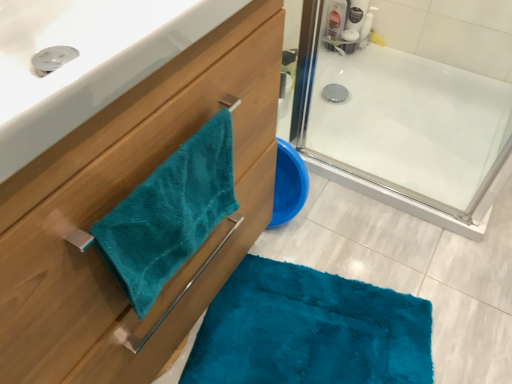
Identify the location of teal plush towel at left. (121, 200).

Find the location of `teal plush towel at left`. teal plush towel at left is located at coordinates (121, 200).

Considering the relative sizes of teal plush towel at left and teal plush towel at left in the image provided, is teal plush towel at left shorter than teal plush towel at left?

In fact, teal plush towel at left may be taller than teal plush towel at left.

From the image's perspective, would you say teal plush towel at left is shown under teal plush towel at left?

No, from the image's perspective, teal plush towel at left is not beneath teal plush towel at left.

Based on the photo, how many degrees apart are the facing directions of teal plush towel at left and teal plush towel at left?

The angle between the facing direction of teal plush towel at left and the facing direction of teal plush towel at left is 0.479 degrees.

Is teal plush towel at left surrounded by teal plush towel at left?

No, teal plush towel at left is located outside of teal plush towel at left.

From a real-world perspective, is translucent plastic bottle at upper right under teal plush towel at left?

Indeed, from a real-world perspective, translucent plastic bottle at upper right is positioned beneath teal plush towel at left.

Locate an element on the screen. Image resolution: width=512 pixels, height=384 pixels. cleaning product that is behind the teal plush towel at left is located at coordinates (366, 28).

Between point (367, 34) and point (204, 174), which one is positioned in front?

Point (204, 174)

Could you tell me if teal plush towel at left is facing teal plush towel at left?

No, teal plush towel at left is not aimed at teal plush towel at left.

Considering the relative positions of teal plush towel at left and teal plush towel at left in the image provided, is teal plush towel at left to the left of teal plush towel at left from the viewer's perspective?

No, teal plush towel at left is not to the left of teal plush towel at left.

Which is behind, point (373, 16) or point (202, 118)?

The point (373, 16) is farther.

Is translucent plastic bottle at upper right beside teal plush towel at left?

translucent plastic bottle at upper right and teal plush towel at left are not in contact.

Is translucent plastic bottle at upper right shorter than teal plush towel at left?

Indeed, translucent plastic bottle at upper right has a lesser height compared to teal plush towel at left.

Which object is closer to the camera, teal plush towel at left or translucent plastic bottle at upper right?

teal plush towel at left is more forward.

Measure the distance from teal plush towel at left to translucent plastic bottle at upper right.

They are 29.45 inches apart.

Is translucent plastic bottle at upper right located within teal plush towel at left?

No.

Can you tell me how much teal plush towel at left and translucent plastic bottle at upper right differ in facing direction?

teal plush towel at left and translucent plastic bottle at upper right are facing 1.73 degrees away from each other.

Is teal plush towel at left far away from translucent plastic bottle at upper right?

No, there isn't a large distance between teal plush towel at left and translucent plastic bottle at upper right.

Considering the sizes of teal plush towel at left and translucent plastic bottle at upper right in the image, is teal plush towel at left taller or shorter than translucent plastic bottle at upper right?

Clearly, teal plush towel at left is taller compared to translucent plastic bottle at upper right.

From a real-world perspective, which object stands above the other?

From a 3D spatial view, teal plush towel at left is above.

Considering the positions of points (51, 188) and (370, 37), is point (51, 188) farther from camera compared to point (370, 37)?

No, it is not.

Find the location of a particular element. beach towel located on the right of teal plush towel at left is located at coordinates (169, 214).

Where is `beach towel below the translucent plastic bottle at upper right (from the image's perspective)`? This screenshot has width=512, height=384. beach towel below the translucent plastic bottle at upper right (from the image's perspective) is located at coordinates (169, 214).

Estimate the real-world distances between objects in this image. Which object is further from teal plush towel at left, teal plush towel at left or translucent plastic bottle at upper right?

Among the two, translucent plastic bottle at upper right is located further to teal plush towel at left.

Which object lies further to the anchor point translucent plastic bottle at upper right, teal plush towel at left or teal plush towel at left?

teal plush towel at left is further to translucent plastic bottle at upper right.

Considering their positions, is teal plush towel at left positioned further to translucent plastic bottle at upper right than teal plush towel at left?

teal plush towel at left is further to translucent plastic bottle at upper right.

When comparing their distances from teal plush towel at left, does translucent plastic bottle at upper right or teal plush towel at left seem closer?

The object closer to teal plush towel at left is teal plush towel at left.

Based on their spatial positions, is translucent plastic bottle at upper right or teal plush towel at left further from teal plush towel at left?

translucent plastic bottle at upper right lies further to teal plush towel at left than the other object.

Based on their spatial positions, is teal plush towel at left or translucent plastic bottle at upper right closer to teal plush towel at left?

teal plush towel at left lies closer to teal plush towel at left than the other object.

Where is `beach towel located between teal plush towel at left and translucent plastic bottle at upper right in the depth direction`? The height and width of the screenshot is (384, 512). beach towel located between teal plush towel at left and translucent plastic bottle at upper right in the depth direction is located at coordinates (169, 214).